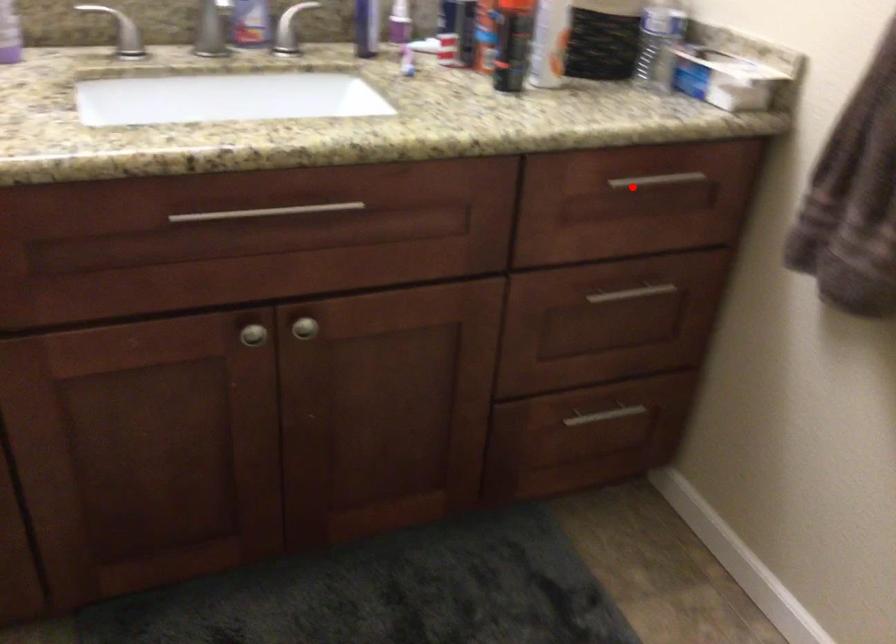
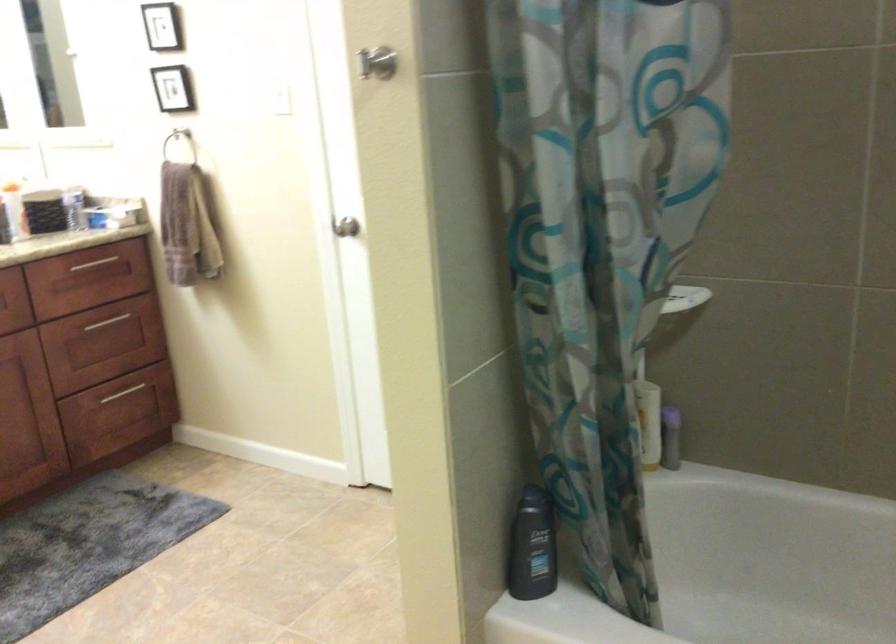
Question: I am providing you with two images of the same scene from different viewpoints. Image1 has a red point marked. In image2, the corresponding 3D location appears at what relative position? Reply with the corresponding letter.

Choices:
 (A) Closer
 (B) Farther

Answer: (B)